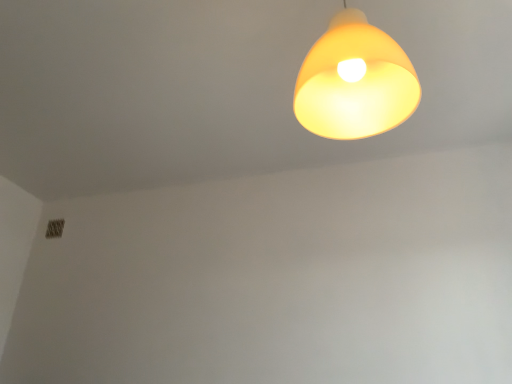
What is the approximate height of matte yellow plastic lampshade at upper center?

It is 21.74 inches.

Locate an element on the screen. matte yellow plastic lampshade at upper center is located at coordinates (355, 82).

The height and width of the screenshot is (384, 512). What do you see at coordinates (355, 82) in the screenshot?
I see `matte yellow plastic lampshade at upper center` at bounding box center [355, 82].

Identify the location of matte yellow plastic lampshade at upper center. (355, 82).